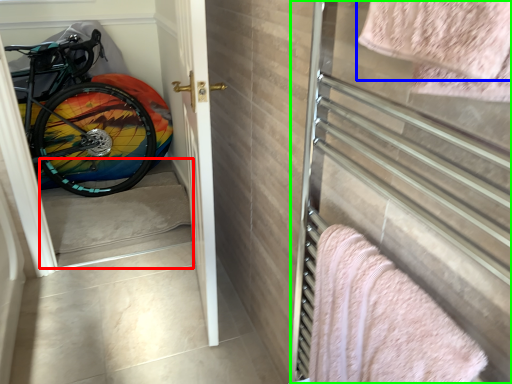
Question: Which object is positioned closest to stairwell (highlighted by a red box)? Select from towel (highlighted by a blue box) and screen door (highlighted by a green box).

Choices:
 (A) towel
 (B) screen door

Answer: (B)